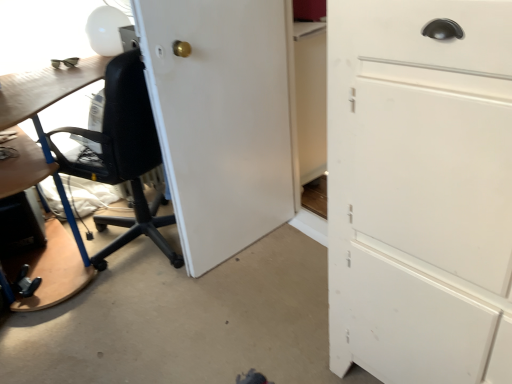
Question: Which is correct: white matte cabinet at right is inside white glossy table lamp at upper left, or outside of it?

Choices:
 (A) inside
 (B) outside

Answer: (B)

Question: Considering the relative positions of white matte cabinet at right and white glossy table lamp at upper left in the image provided, is white matte cabinet at right to the left or to the right of white glossy table lamp at upper left?

Choices:
 (A) right
 (B) left

Answer: (A)

Question: Which object is positioned closest to the white matte door at center?

Choices:
 (A) black mesh chair at left
 (B) white glossy table lamp at upper left
 (C) white matte cabinet at right

Answer: (A)

Question: Which object is positioned closest to the white glossy table lamp at upper left?

Choices:
 (A) white matte cabinet at right
 (B) white matte door at center
 (C) black mesh chair at left

Answer: (C)